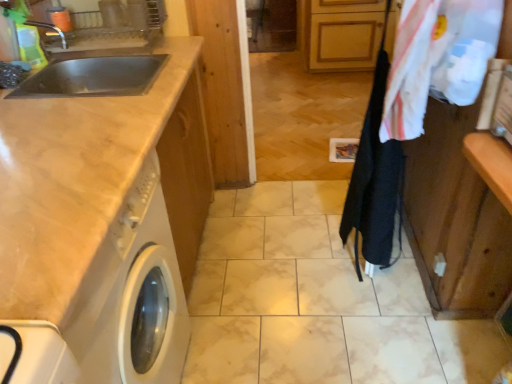
Question: Does white glossy washing machine at left have a smaller size compared to white cotton laundry at upper right?

Choices:
 (A) no
 (B) yes

Answer: (A)

Question: Is white glossy washing machine at left oriented away from white cotton laundry at upper right?

Choices:
 (A) yes
 (B) no

Answer: (B)

Question: Considering the relative sizes of white glossy washing machine at left and white cotton laundry at upper right in the image provided, is white glossy washing machine at left wider than white cotton laundry at upper right?

Choices:
 (A) no
 (B) yes

Answer: (B)

Question: Can you confirm if white glossy washing machine at left is positioned to the left of white cotton laundry at upper right?

Choices:
 (A) yes
 (B) no

Answer: (A)

Question: Can you confirm if white glossy washing machine at left is taller than white cotton laundry at upper right?

Choices:
 (A) yes
 (B) no

Answer: (A)

Question: Are white glossy washing machine at left and white cotton laundry at upper right beside each other?

Choices:
 (A) no
 (B) yes

Answer: (A)

Question: Considering the relative sizes of matte beige countertop at left and white glossy washing machine at left in the image provided, is matte beige countertop at left shorter than white glossy washing machine at left?

Choices:
 (A) no
 (B) yes

Answer: (A)

Question: Is matte beige countertop at left taller than white glossy washing machine at left?

Choices:
 (A) yes
 (B) no

Answer: (A)

Question: Is matte beige countertop at left at the right side of white glossy washing machine at left?

Choices:
 (A) no
 (B) yes

Answer: (B)

Question: From the image's perspective, is matte beige countertop at left on white glossy washing machine at left?

Choices:
 (A) no
 (B) yes

Answer: (B)

Question: Is matte beige countertop at left behind white glossy washing machine at left?

Choices:
 (A) no
 (B) yes

Answer: (B)

Question: Is white glossy washing machine at left surrounded by matte beige countertop at left?

Choices:
 (A) no
 (B) yes

Answer: (A)

Question: Is white cotton laundry at upper right oriented away from white glossy washing machine at left?

Choices:
 (A) yes
 (B) no

Answer: (B)